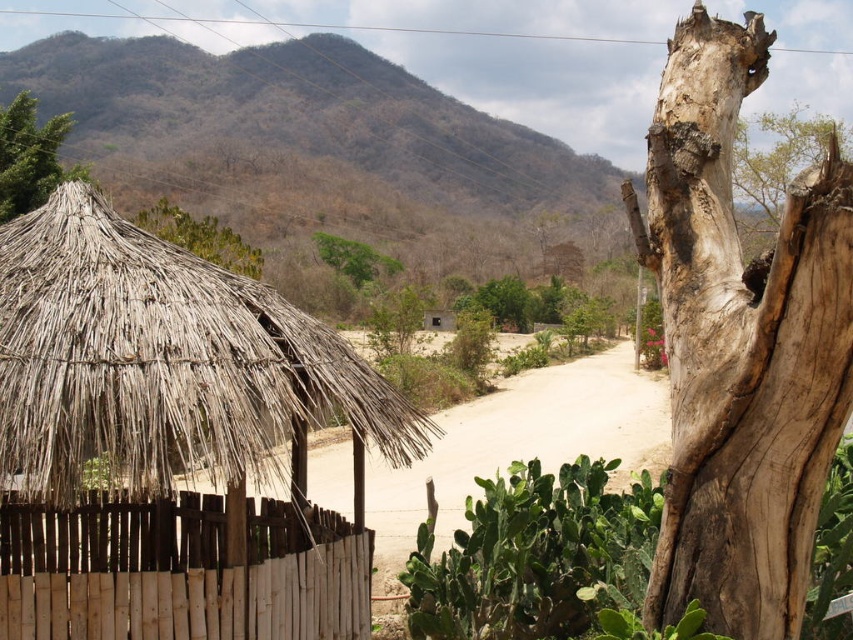
You are a traveler who wants to find shade from the sun. You see the thatched straw hut at left and the green leafy bush at upper center. Which one provides taller shade?

The green leafy bush at upper center is taller than the thatched straw hut at left, so it provides taller shade.

You are standing at the thatched roof structure on the left and want to walk to the point marked as point (167, 218). Which direction should you turn to face the point (633, 196) first before proceeding?

Point (633, 196) is closer to the viewer than point (167, 218), so you should turn towards the direction of point (633, 196) first before proceeding to point (167, 218).

You are standing at the center of the dirt path in the image. Looking towards the right side, you notice a specific point marked at coordinates (740, 346). What feature does this point indicate?

The point at (740, 346) marks the location of the light brown rough bark at right.